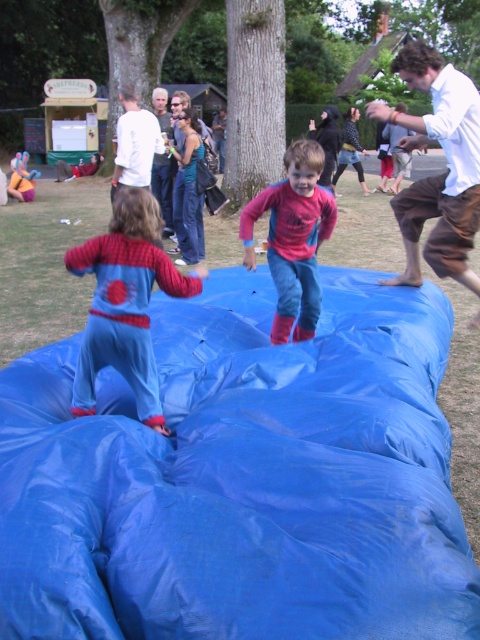
Question: Where is blue rubber mat at center located in relation to blue plush pajamas at center in the image?

Choices:
 (A) right
 (B) left

Answer: (A)

Question: Can you confirm if blue rubber mat at center is positioned to the left of red matte spider-man costume at center?

Choices:
 (A) no
 (B) yes

Answer: (B)

Question: Which object is the closest to the red matte spider-man costume at center?

Choices:
 (A) blue plush pajamas at center
 (B) blue rubber mat at center

Answer: (A)

Question: Which of the following is the closest to the observer?

Choices:
 (A) (279, 259)
 (B) (260, 561)

Answer: (B)

Question: Which point is farther to the camera?

Choices:
 (A) (256, 218)
 (B) (27, 372)

Answer: (A)

Question: Does blue rubber mat at center appear on the left side of blue plush pajamas at center?

Choices:
 (A) no
 (B) yes

Answer: (A)